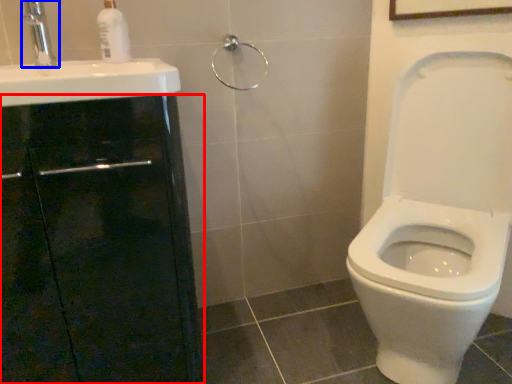
Question: Among these objects, which one is farthest to the camera, screen door (highlighted by a red box) or tap (highlighted by a blue box)?

Choices:
 (A) screen door
 (B) tap

Answer: (B)